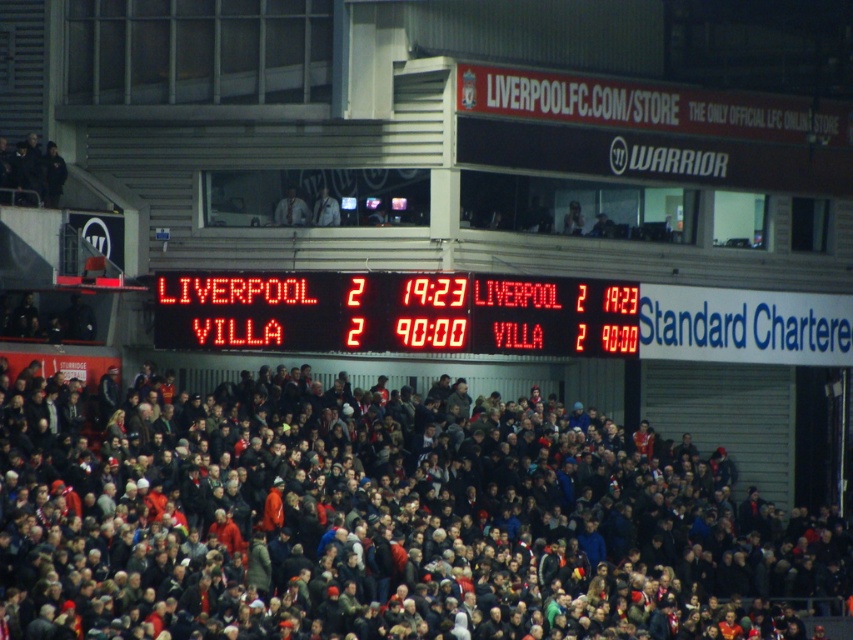
Question: Among these objects, which one is farthest from the camera?

Choices:
 (A) dark gray crowd at center
 (B) red led scoreboard at center

Answer: (B)

Question: Considering the relative positions of dark gray crowd at center and red led scoreboard at center in the image provided, where is dark gray crowd at center located with respect to red led scoreboard at center?

Choices:
 (A) left
 (B) right

Answer: (B)

Question: Which point appears farthest from the camera in this image?

Choices:
 (A) (755, 564)
 (B) (386, 276)

Answer: (A)

Question: Which of the following is the farthest from the observer?

Choices:
 (A) dark gray crowd at center
 (B) red led scoreboard at center

Answer: (B)

Question: Is dark gray crowd at center below red led scoreboard at center?

Choices:
 (A) no
 (B) yes

Answer: (B)

Question: Is dark gray crowd at center smaller than red led scoreboard at center?

Choices:
 (A) yes
 (B) no

Answer: (B)